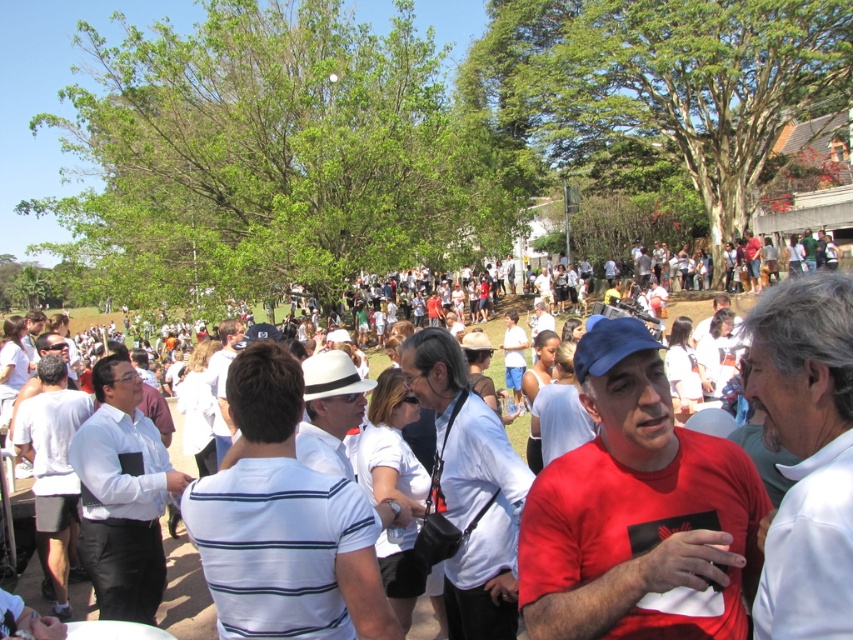
You are standing at the center of the park and see a point marked at coordinates [469,488]. According to the image, where is this point located?

The point at coordinates [469,488] is located on the white matte shirt at center.

You are standing at the edge of the crowd in the park. You see two points marked in the scene. The first point is at coordinates point (229, 481) and the second is at point (430, 401). Which point is closer to you?

The point at (229, 481) is closer to you than the point at (430, 401).

You are a photographer at the event and want to capture a photo of both the white striped shirt at center and the white matte shirt at center. Which shirt should you focus on first to ensure the taller one is in the frame?

The white matte shirt at center is taller than the white striped shirt at center, so you should focus on the white matte shirt at center first to ensure it is fully captured in the frame.